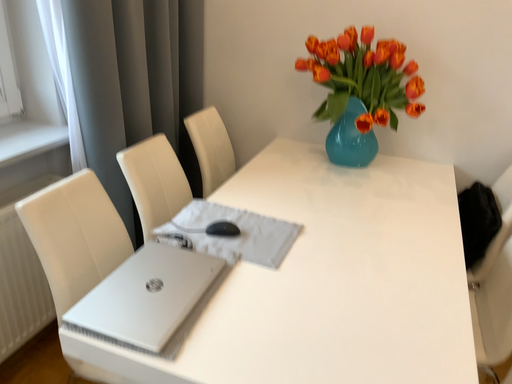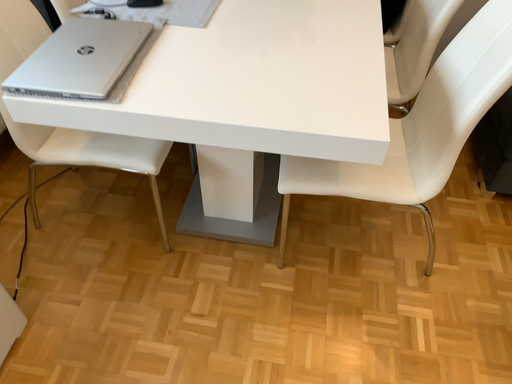
Question: How did the camera likely rotate when shooting the video?

Choices:
 (A) rotated right
 (B) rotated left

Answer: (A)